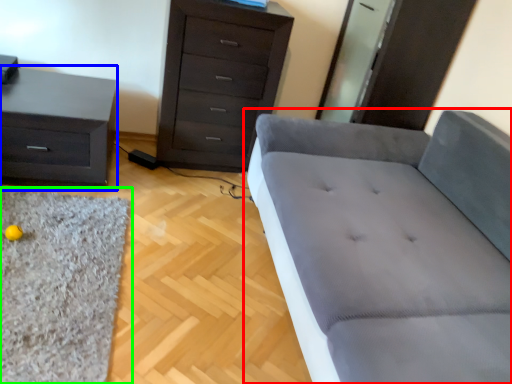
Question: Based on their relative distances, which object is nearer to studio couch (highlighted by a red box)? Choose from nightstand (highlighted by a blue box) and mat (highlighted by a green box).

Choices:
 (A) nightstand
 (B) mat

Answer: (B)